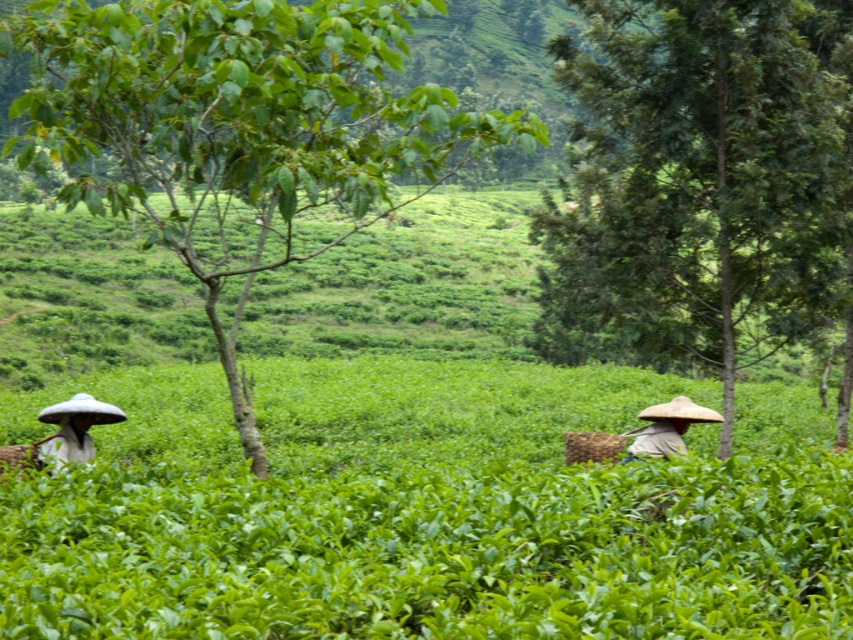
Question: Which point is farther to the camera?

Choices:
 (A) (685, 426)
 (B) (206, 291)
 (C) (115, 420)
 (D) (817, 93)

Answer: (B)

Question: Does matte white hat at left appear over light brown straw hat at right?

Choices:
 (A) no
 (B) yes

Answer: (B)

Question: Can you confirm if matte white hat at left is bigger than light brown straw hat at right?

Choices:
 (A) no
 (B) yes

Answer: (A)

Question: Can you confirm if matte white hat at left is thinner than light brown straw hat at right?

Choices:
 (A) yes
 (B) no

Answer: (A)

Question: Which of the following is the closest to the observer?

Choices:
 (A) green leafy tree at left
 (B) matte white hat at left
 (C) green leafy tree at right

Answer: (A)

Question: Which point is farther from the camera taking this photo?

Choices:
 (A) (688, 408)
 (B) (202, 19)

Answer: (A)